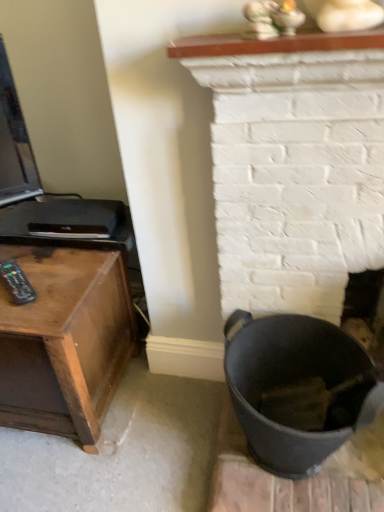
The width and height of the screenshot is (384, 512). What do you see at coordinates (293, 164) in the screenshot?
I see `white brick fireplace at center` at bounding box center [293, 164].

The image size is (384, 512). In order to click on white brick fireplace at center in this screenshot , I will do [x=293, y=164].

Locate an element on the screen. white brick fireplace at center is located at coordinates (293, 164).